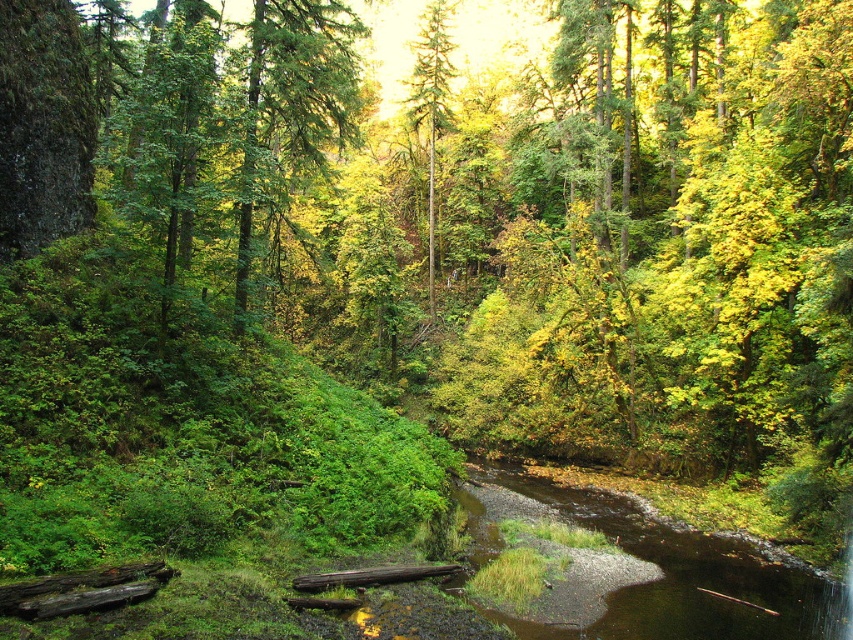
You are a hiker who wants to cross the brown gravel river at center. There is a green matte tree at center nearby. Which direction should you walk to reach the river from the tree?

The brown gravel river at center is located below the green matte tree at center, so you should walk downward from the green matte tree at center to reach the river.

You are a hiker who wants to cross the brown gravel river at center. Where exactly should you step to cross it safely?

The brown gravel river at center is located at point [679,577], so you should step there to cross safely.